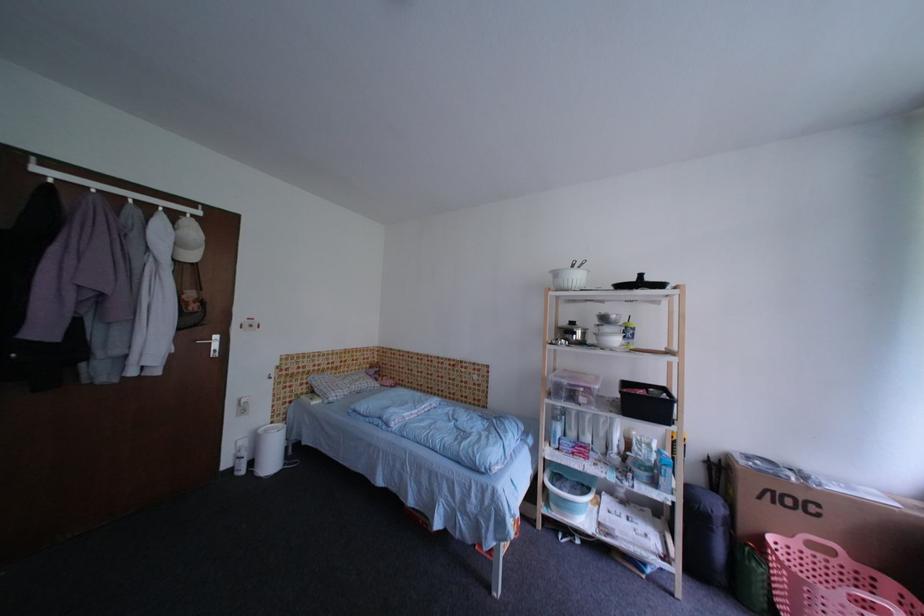
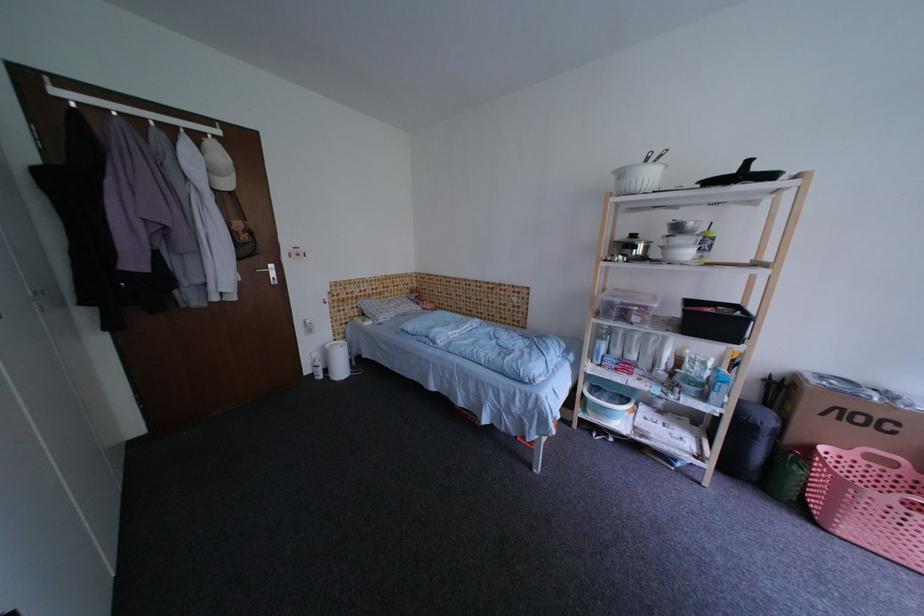
Find the pixel in the second image that matches pixel 251 456 in the first image.

(326, 366)